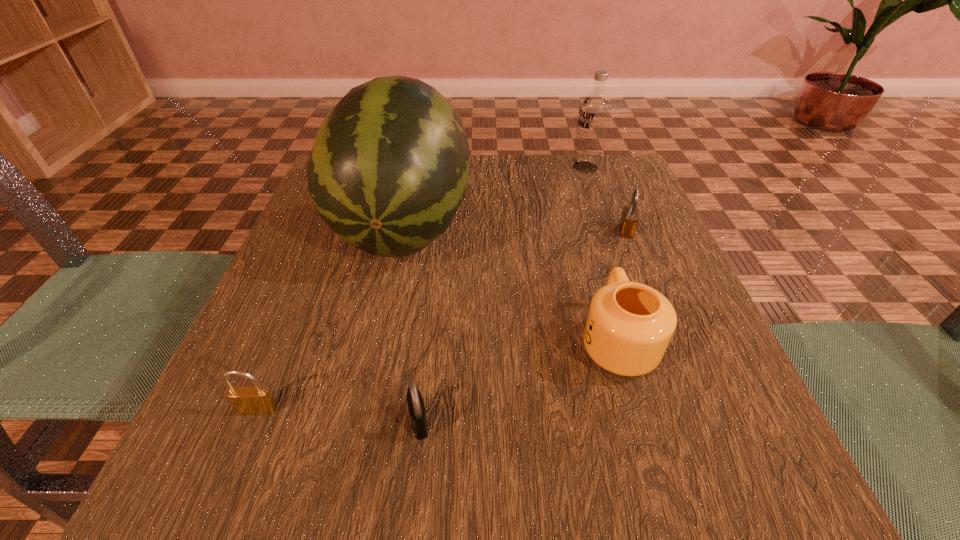
Find the location of `watermelon`. watermelon is located at coordinates (388, 171).

Where is `the farthest object`? This screenshot has width=960, height=540. the farthest object is located at coordinates (595, 108).

Locate an element on the screen. This screenshot has width=960, height=540. the fifth shortest object is located at coordinates (595, 108).

Identify the location of mug. This screenshot has height=540, width=960. (629, 325).

Find the location of a particular element. The image size is (960, 540). the fourth shortest object is located at coordinates (629, 325).

Locate an element on the screen. the rightmost padlock is located at coordinates (629, 219).

Identify the location of the leftmost padlock. (250, 400).

Locate an element on the screen. the second padlock from right to left is located at coordinates (416, 407).

The height and width of the screenshot is (540, 960). Identify the location of vacant point located on the right of the tallest object. (539, 225).

Where is `vacant space situated on the front label of the vodka`? Image resolution: width=960 pixels, height=540 pixels. vacant space situated on the front label of the vodka is located at coordinates (408, 167).